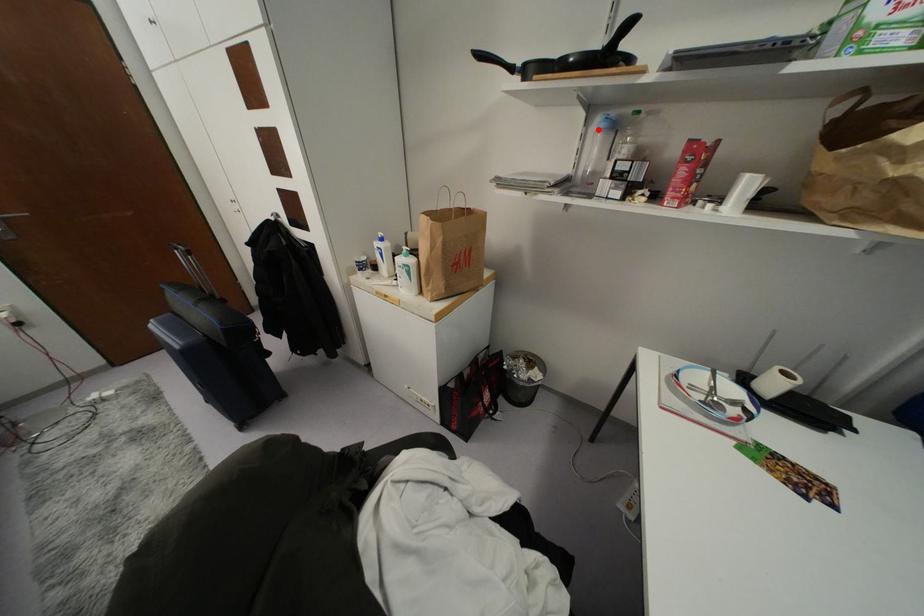
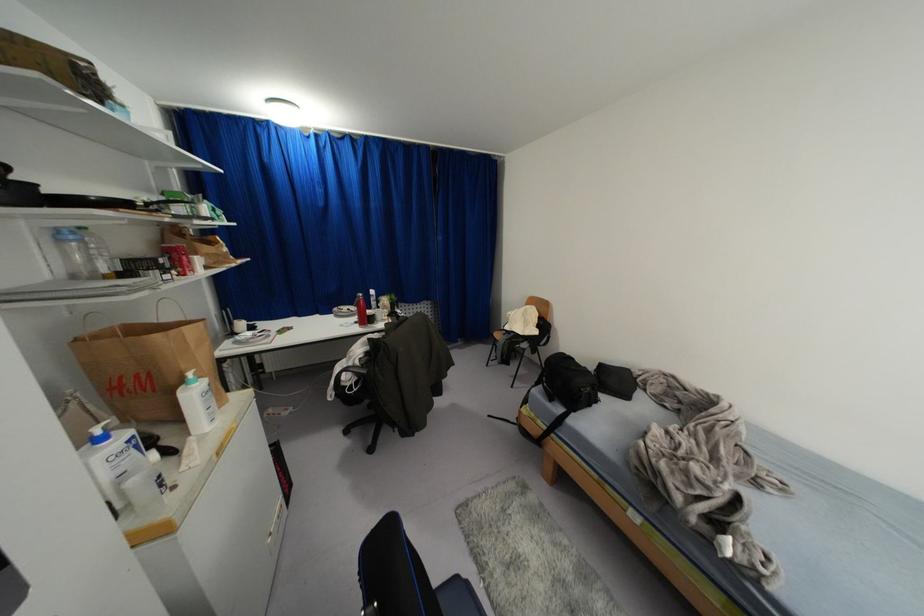
Locate, in the second image, the point that corresponds to the highlighted location in the first image.

(62, 240)